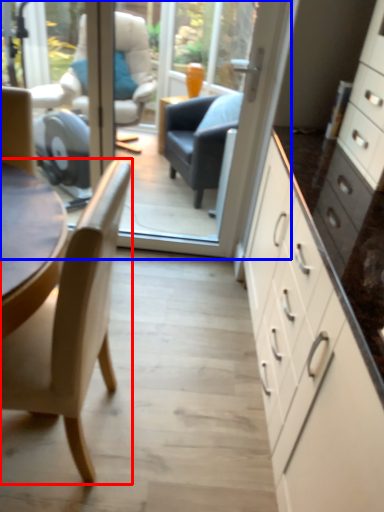
Question: Which point is closer to the camera, chair (highlighted by a red box) or glass door (highlighted by a blue box)?

Choices:
 (A) chair
 (B) glass door

Answer: (A)